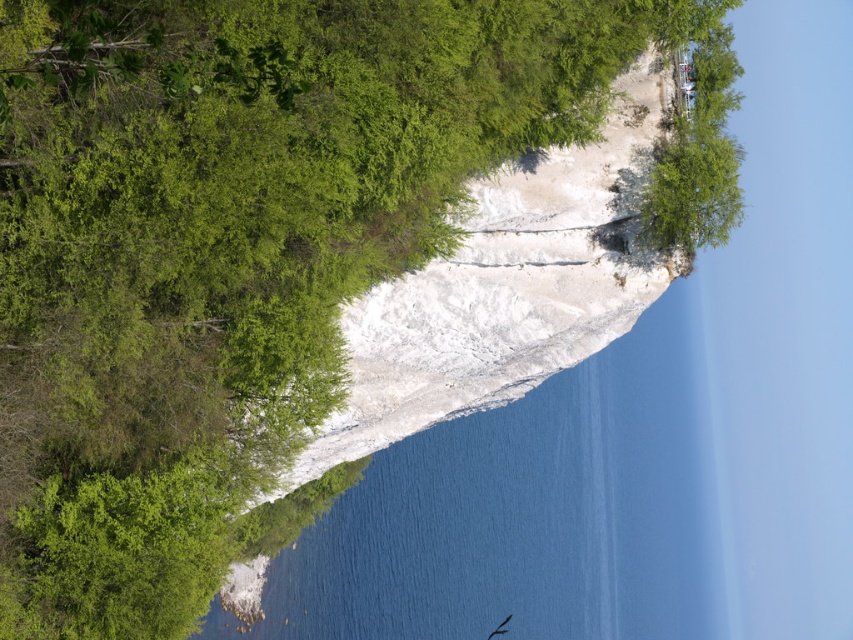
Question: Which point is closer to the camera?

Choices:
 (A) (502, 486)
 (B) (508, 618)

Answer: (B)

Question: Does clear blue water at center appear on the left side of smooth feathered bird at lower center?

Choices:
 (A) no
 (B) yes

Answer: (A)

Question: Does clear blue water at center have a larger size compared to green leafy tree at upper right?

Choices:
 (A) yes
 (B) no

Answer: (A)

Question: Which object appears farthest from the camera in this image?

Choices:
 (A) green leafy tree at upper right
 (B) smooth feathered bird at lower center

Answer: (B)

Question: Can you confirm if clear blue water at center is positioned to the left of green leafy tree at upper right?

Choices:
 (A) no
 (B) yes

Answer: (A)

Question: Which of the following is the farthest from the observer?

Choices:
 (A) clear blue water at center
 (B) smooth feathered bird at lower center

Answer: (B)